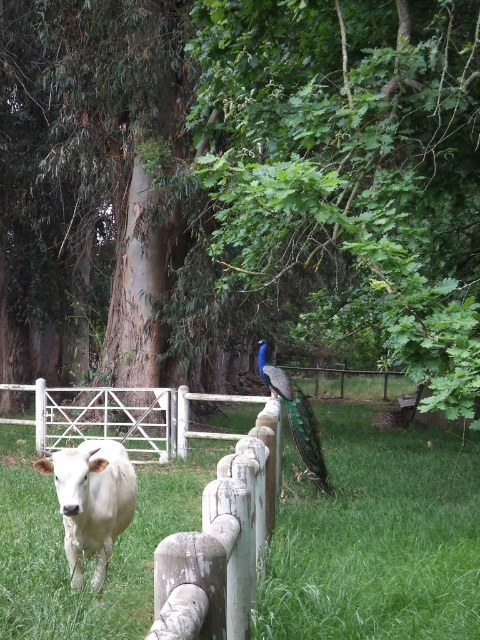
You are a photographer standing in front of the wooden fence. You want to take a photo that includes both the green leafy tree at center and the white glossy bull at center. Which object should you frame wider in your camera to capture its full width?

The green leafy tree at center has a larger width than the white glossy bull at center, so you should frame the green leafy tree at center wider to capture its full width.

You are standing in front of the wooden fence in the rural scene. You see the green leafy tree at center and the white glossy bull at center. Which one is more to the right?

A: The green leafy tree at center is positioned on the right side of white glossy bull at center, so the green leafy tree at center is more to the right.

You are standing in a rural area and want to take a photo of the green leafy tree at center. Considering the distance between you and the tree, can you comfortably fit the entire tree in your smartphone camera frame without zooming?

The distance between you and the green leafy tree at center is 11.63 feet, which is a comfortable distance for most smartphones to capture the entire tree without zooming.